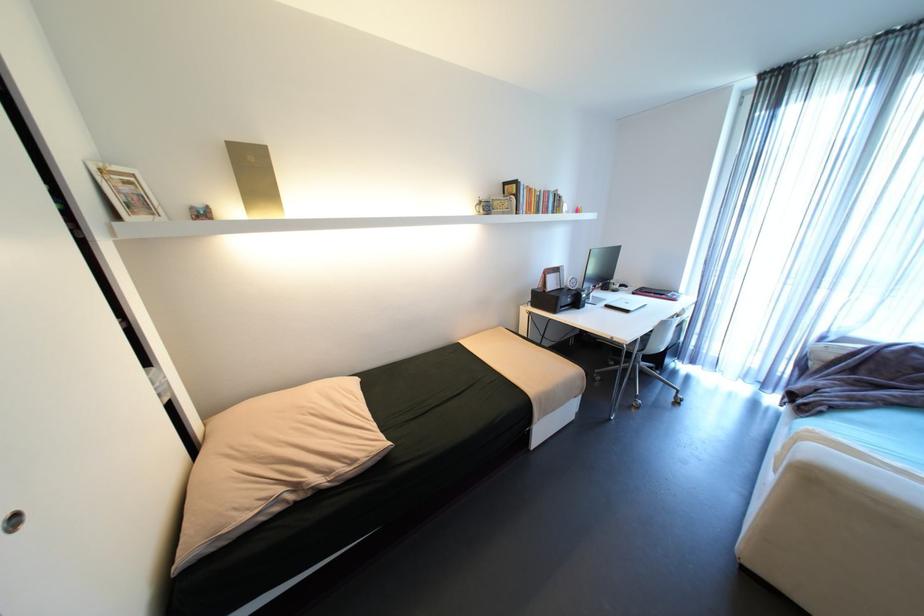
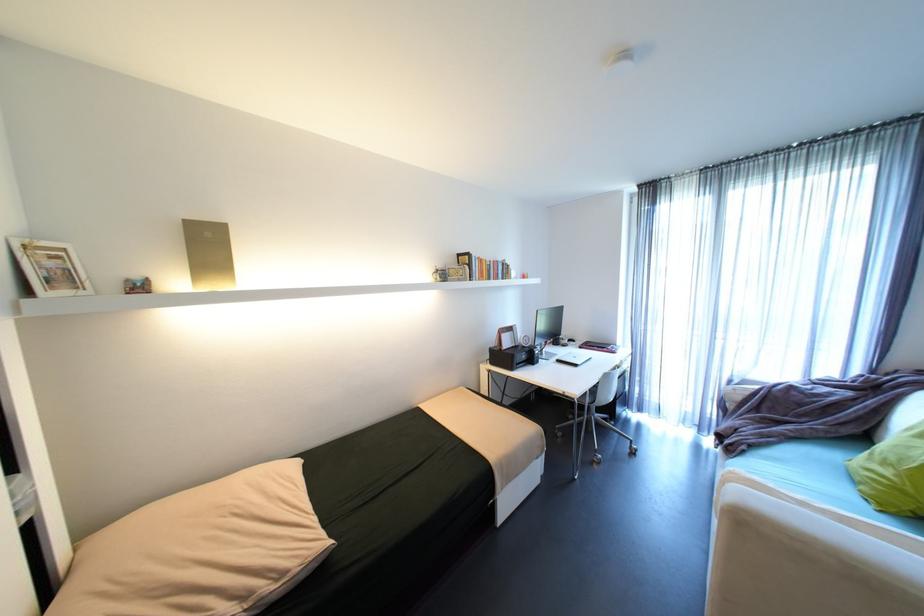
Locate, in the second image, the point that corresponds to point (360, 462) in the first image.

(289, 575)